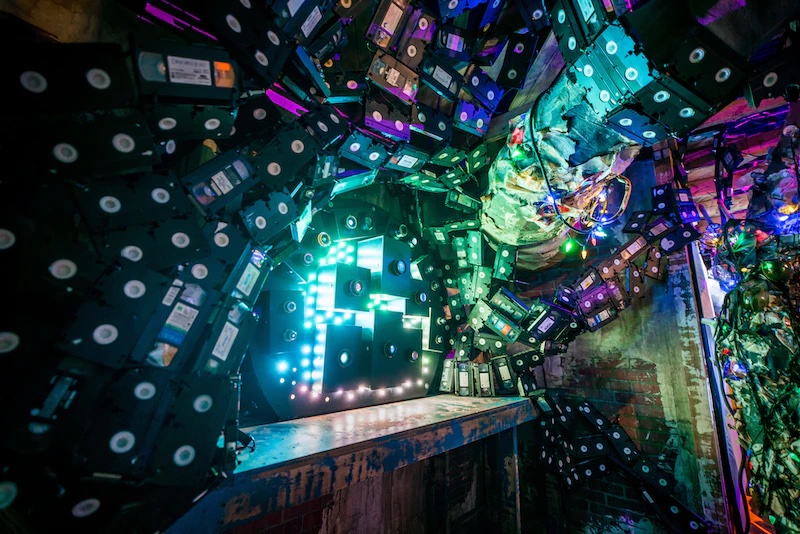
At what (x,y) coordinates should I click in order to perform the action: click on wall lights. Please return your answer as a coordinate pair (x, y). The height and width of the screenshot is (534, 800). Looking at the image, I should click on (318, 348), (313, 395), (282, 366).